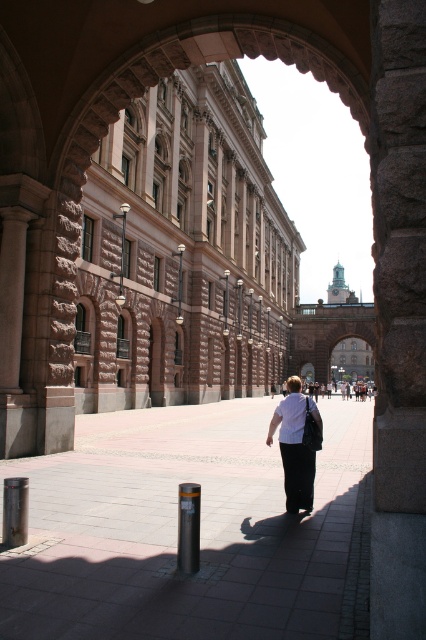
Based on the photo, you are standing at the entrance of the archway and want to walk towards the grand building. There is a smooth concrete pavement at center and a black polished metal post at center in your path. Which one do you need to step over or around since it is narrower?

The black polished metal post at center is narrower than the smooth concrete pavement at center, so you would need to step over or around it since it is narrower.

You are standing in front of the archway looking at the grand building. There are two points marked in the image, point 1 at coordinates (213, 609) and point 2 at coordinates (302, 406). Which point is closer to you?

Point 1 at coordinates (213, 609) is closer to you than point 2 at coordinates (302, 406).

You are standing in front of the archway and notice the smooth concrete pavement at center and the white matte shirt at center. Which object is closer to your eye level?

The white matte shirt at center is closer to your eye level because it is taller than the smooth concrete pavement at center.